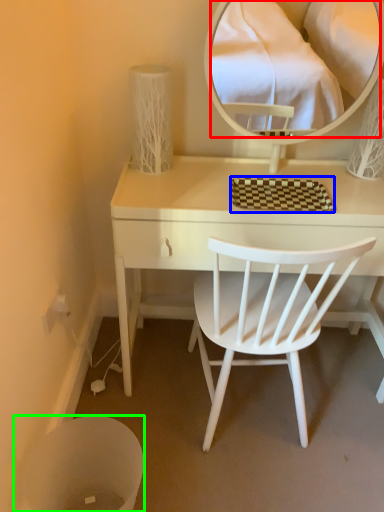
Question: Which object is the closest to the mirror (highlighted by a red box)? Choose among these: mat (highlighted by a blue box) or trash bin/can (highlighted by a green box).

Choices:
 (A) mat
 (B) trash bin/can

Answer: (A)